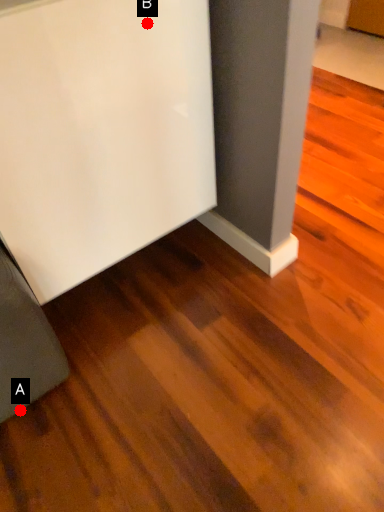
Question: Two points are circled on the image, labeled by A and B beside each circle. Which point is further to the camera?

Choices:
 (A) A is further
 (B) B is further

Answer: (A)